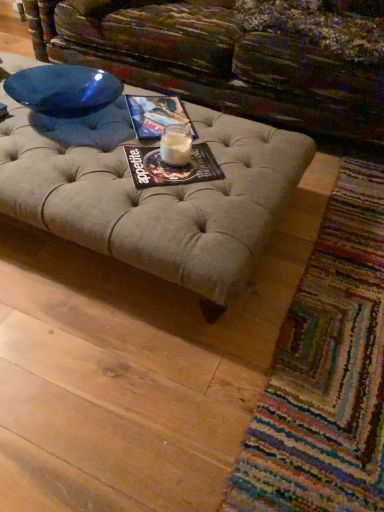
Question: Is white glass candle at center far away from multicolored woven mat at lower right?

Choices:
 (A) yes
 (B) no

Answer: (B)

Question: Is the surface of white glass candle at center in direct contact with multicolored woven mat at lower right?

Choices:
 (A) yes
 (B) no

Answer: (B)

Question: Can you confirm if white glass candle at center is thinner than multicolored woven mat at lower right?

Choices:
 (A) no
 (B) yes

Answer: (B)

Question: From the image's perspective, would you say white glass candle at center is shown under multicolored woven mat at lower right?

Choices:
 (A) yes
 (B) no

Answer: (B)

Question: From a real-world perspective, is white glass candle at center under multicolored woven mat at lower right?

Choices:
 (A) yes
 (B) no

Answer: (B)

Question: Is white glass candle at center at the left side of multicolored woven mat at lower right?

Choices:
 (A) no
 (B) yes

Answer: (B)

Question: Considering the relative sizes of matte paper magazine at center, arranged as the 2th magazine when viewed from the back, and multicolored woven mat at lower right in the image provided, is matte paper magazine at center, arranged as the 2th magazine when viewed from the back, shorter than multicolored woven mat at lower right?

Choices:
 (A) yes
 (B) no

Answer: (A)

Question: Is the depth of matte paper magazine at center, which ranks as the first magazine in bottom-to-top order, less than that of multicolored woven mat at lower right?

Choices:
 (A) no
 (B) yes

Answer: (A)

Question: Would you consider matte paper magazine at center, which ranks as the first magazine in bottom-to-top order, to be distant from multicolored woven mat at lower right?

Choices:
 (A) yes
 (B) no

Answer: (B)

Question: From the image's perspective, is matte paper magazine at center, arranged as the 2th magazine when viewed from the back, located above multicolored woven mat at lower right?

Choices:
 (A) no
 (B) yes

Answer: (B)

Question: Is matte paper magazine at center, arranged as the 2th magazine when viewed from the back, further to the viewer compared to multicolored woven mat at lower right?

Choices:
 (A) yes
 (B) no

Answer: (A)

Question: Could you tell me if matte paper magazine at center, the 2th magazine when ordered from top to bottom, is facing multicolored woven mat at lower right?

Choices:
 (A) yes
 (B) no

Answer: (B)

Question: Is matte paper magazine at center, positioned as the 1th magazine in top-to-bottom order, at the back of white glass candle at center?

Choices:
 (A) no
 (B) yes

Answer: (A)